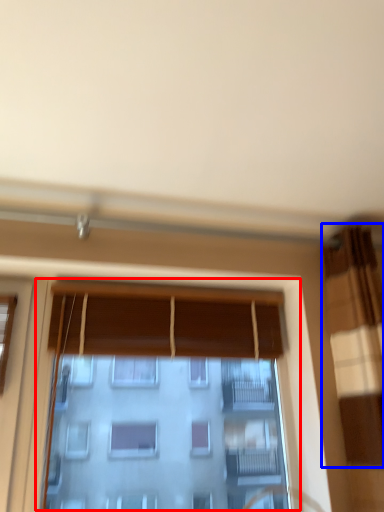
Question: Which object appears closest to the camera in this image, window (highlighted by a red box) or curtain (highlighted by a blue box)?

Choices:
 (A) window
 (B) curtain

Answer: (B)